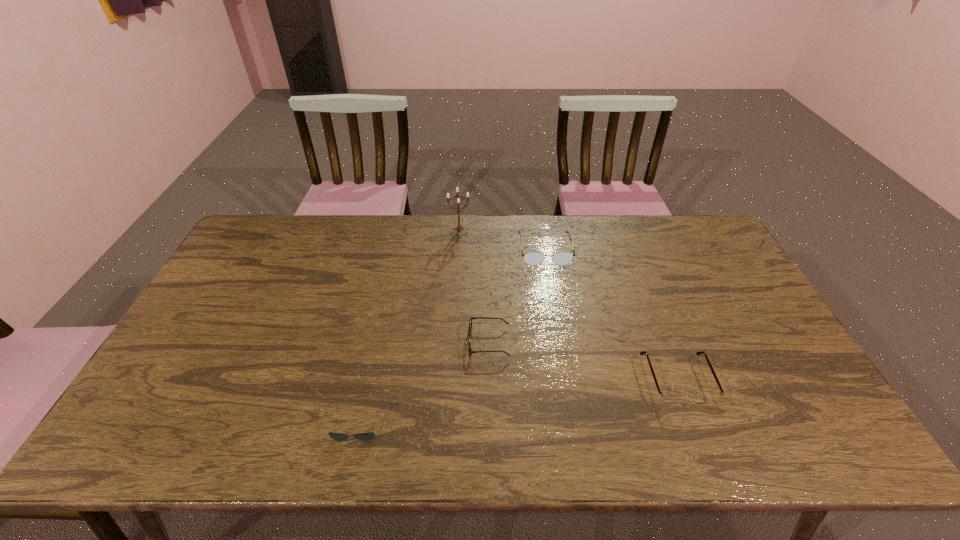
In order to click on object identified as the third closest to the shortest spectacles in this screenshot , I will do `click(666, 398)`.

Image resolution: width=960 pixels, height=540 pixels. I want to click on spectacles that stands as the second closest to the leftmost object, so click(532, 258).

Find the location of a particular element. The width and height of the screenshot is (960, 540). spectacles that stands as the second closest to the shortest spectacles is located at coordinates (666, 398).

Locate an element on the screen. vacant space that satisfies the following two spatial constraints: 1. on the front-facing side of the leftmost spectacles; 2. on the lenses of the leftmost object is located at coordinates (490, 422).

At what (x,y) coordinates should I click in order to perform the action: click on free space in the image that satisfies the following two spatial constraints: 1. on the lenses of the fourth object from left to right; 2. on the front-facing side of the shortest spectacles. Please return your answer as a coordinate pair (x, y). This screenshot has height=540, width=960. Looking at the image, I should click on (561, 342).

Where is `vacant space that satisfies the following two spatial constraints: 1. on the lenses of the second spectacles from left to right; 2. on the front-facing side of the shortest spectacles`? The image size is (960, 540). vacant space that satisfies the following two spatial constraints: 1. on the lenses of the second spectacles from left to right; 2. on the front-facing side of the shortest spectacles is located at coordinates (561, 342).

At what (x,y) coordinates should I click in order to perform the action: click on free spot that satisfies the following two spatial constraints: 1. on the lenses of the second object from right to left; 2. on the front-facing side of the leftmost spectacles. Please return your answer as a coordinate pair (x, y). The image size is (960, 540). Looking at the image, I should click on (561, 342).

The height and width of the screenshot is (540, 960). What are the coordinates of `vacant space that satisfies the following two spatial constraints: 1. on the front-facing side of the leftmost spectacles; 2. on the lenses of the sunglasses` in the screenshot? It's located at (490, 422).